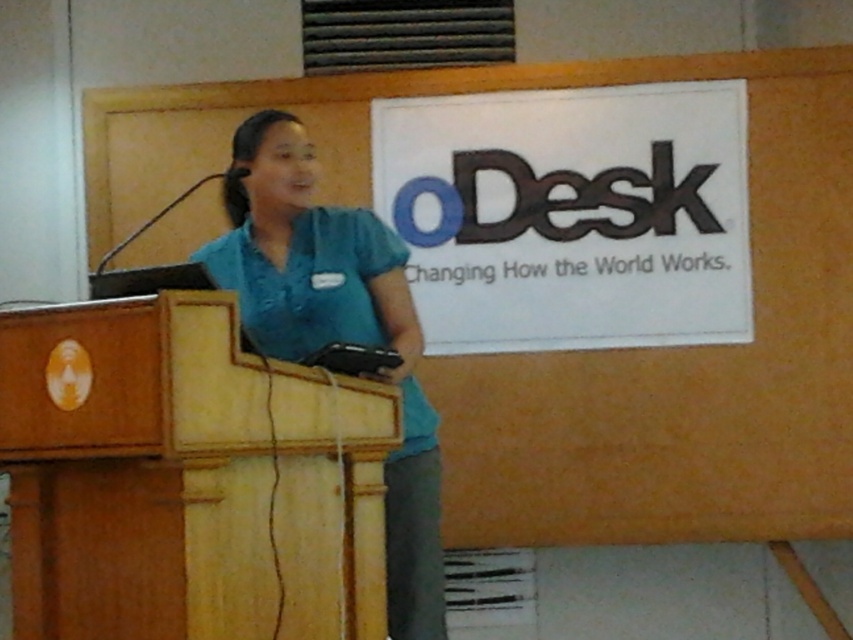
Can you confirm if wooden podium at center is positioned above teal fabric shirt at center?

No.

What do you see at coordinates (184, 477) in the screenshot?
I see `wooden podium at center` at bounding box center [184, 477].

Identify the location of wooden podium at center. The height and width of the screenshot is (640, 853). (184, 477).